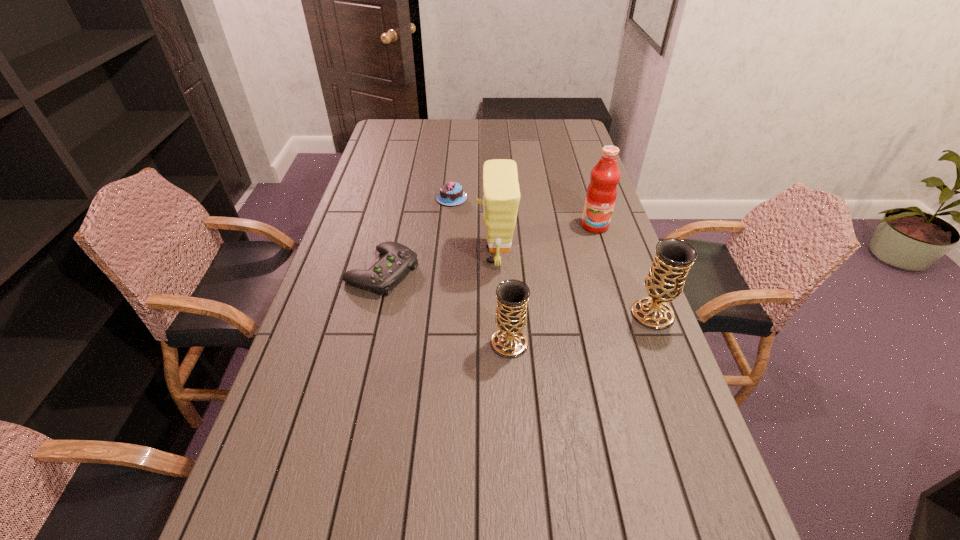
At what (x,y) coordinates should I click in order to perform the action: click on free space at the far edge. Please return your answer as a coordinate pair (x, y). Looking at the image, I should click on (473, 136).

In the image, there is a desktop. Where is `vacant region at the near edge`? The width and height of the screenshot is (960, 540). vacant region at the near edge is located at coordinates (339, 473).

At what (x,y) coordinates should I click in order to perform the action: click on free region at the left edge of the desktop. Please return your answer as a coordinate pair (x, y). The height and width of the screenshot is (540, 960). Looking at the image, I should click on (329, 291).

Where is `vacant space at the right edge of the desktop`? The image size is (960, 540). vacant space at the right edge of the desktop is located at coordinates (592, 262).

This screenshot has width=960, height=540. Find the location of `vacant region at the near left corner of the desktop`. vacant region at the near left corner of the desktop is located at coordinates (278, 469).

Identify the location of vacant space at the near right corner of the desktop. This screenshot has height=540, width=960. (682, 498).

The image size is (960, 540). I want to click on free point between the second farthest object and the sponge, so click(545, 240).

Find the location of a particular element. Image resolution: width=960 pixels, height=540 pixels. free spot between the fruit juice and the fourth shortest object is located at coordinates (624, 270).

The width and height of the screenshot is (960, 540). In order to click on free space between the taller chalice and the farthest object in this screenshot , I will do `click(552, 256)`.

This screenshot has height=540, width=960. I want to click on vacant area between the third tallest object and the sponge, so tap(574, 285).